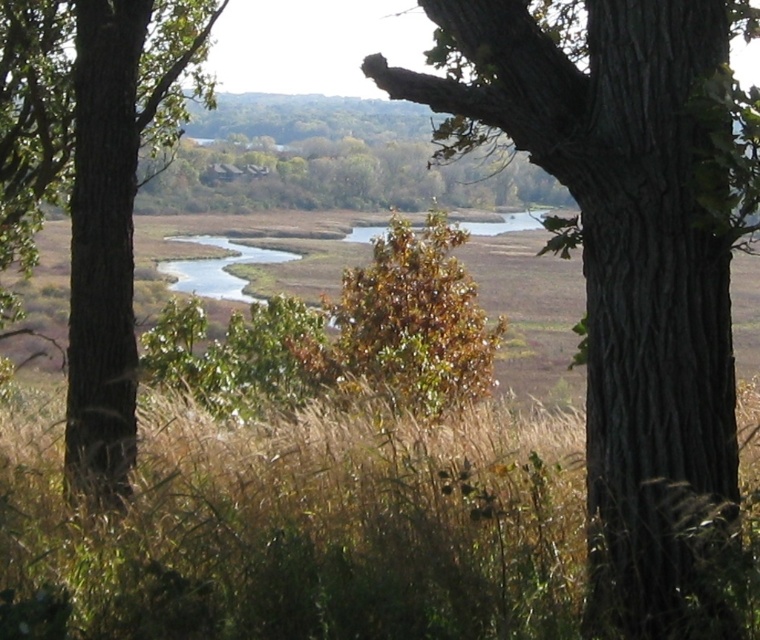
In the scene shown: Is brown grass at center in front of brown rough tree trunk at left?

Yes, brown grass at center is closer to the viewer.

Between brown grass at center and brown rough tree trunk at left, which one is positioned lower?

Positioned lower is brown grass at center.

Image resolution: width=760 pixels, height=640 pixels. What are the coordinates of `brown grass at center` in the screenshot? It's located at (304, 529).

Does brown grass at center have a smaller size compared to smooth bark tree at center?

Correct, brown grass at center occupies less space than smooth bark tree at center.

Between brown grass at center and smooth bark tree at center, which one has less height?

brown grass at center is shorter.

I want to click on brown grass at center, so click(x=304, y=529).

Can you confirm if smooth bark tree at center is wider than brown rough tree trunk at left?

In fact, smooth bark tree at center might be narrower than brown rough tree trunk at left.

This screenshot has width=760, height=640. What do you see at coordinates (629, 260) in the screenshot? I see `smooth bark tree at center` at bounding box center [629, 260].

Between point (730, 17) and point (124, 397), which one is positioned behind?

Positioned behind is point (124, 397).

Image resolution: width=760 pixels, height=640 pixels. Identify the location of smooth bark tree at center. (629, 260).